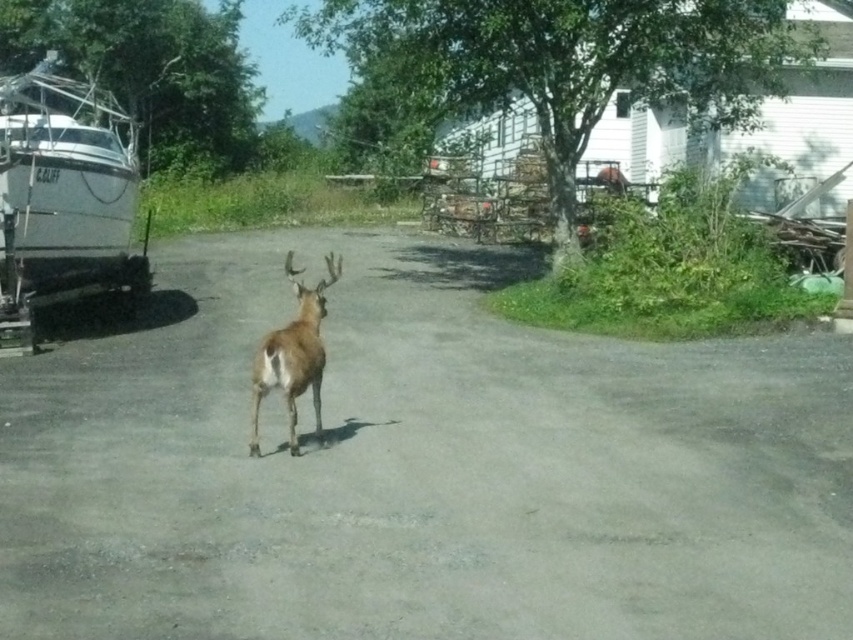
Does white matte boat at left have a lesser width compared to brown furry deer at center?

Incorrect, white matte boat at left's width is not less than brown furry deer at center's.

Which is in front, point (20, 195) or point (258, 348)?

Point (20, 195) is more forward.

At what (x,y) coordinates should I click in order to perform the action: click on white matte boat at left. Please return your answer as a coordinate pair (x, y). Looking at the image, I should click on (65, 189).

Who is positioned more to the right, gray asphalt driveway at center or white matte boat at left?

gray asphalt driveway at center

Consider the image. Who is more forward, (693, 536) or (132, 200)?

Point (693, 536) is more forward.

Does point (126, 339) lie behind point (20, 93)?

No.

Image resolution: width=853 pixels, height=640 pixels. What are the coordinates of `gray asphalt driveway at center` in the screenshot? It's located at pyautogui.click(x=421, y=467).

Which is behind, point (712, 513) or point (292, 442)?

Point (292, 442)

Is gray asphalt driveway at center taller than brown furry deer at center?

Yes, gray asphalt driveway at center is taller than brown furry deer at center.

Who is more distant from viewer, (813, 465) or (296, 323)?

Positioned behind is point (296, 323).

At what (x,y) coordinates should I click in order to perform the action: click on gray asphalt driveway at center. Please return your answer as a coordinate pair (x, y). Image resolution: width=853 pixels, height=640 pixels. Looking at the image, I should click on coord(421,467).